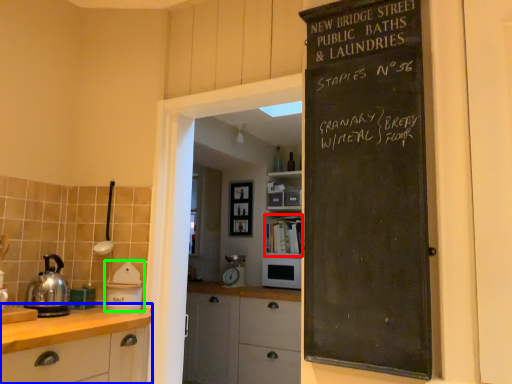
Question: Which is farther away from shelf (highlighted by a red box)? cabinetry (highlighted by a blue box) or appliance (highlighted by a green box)?

Choices:
 (A) cabinetry
 (B) appliance

Answer: (A)